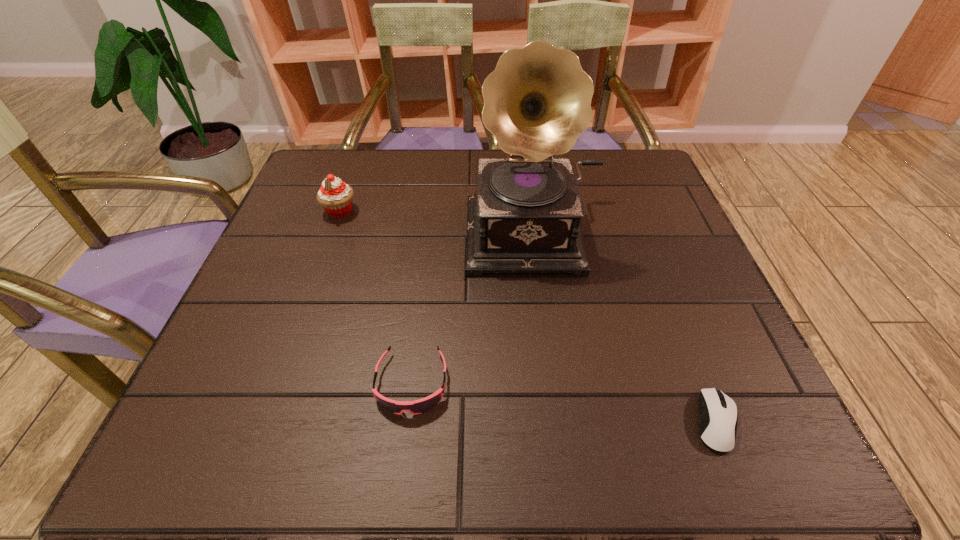
Find the location of a particular element. the tallest object is located at coordinates (524, 217).

Where is `the third object from left to right`? the third object from left to right is located at coordinates (524, 217).

Find the location of a particular element. The image size is (960, 540). the second tallest object is located at coordinates (335, 196).

Locate an element on the screen. The height and width of the screenshot is (540, 960). the leftmost object is located at coordinates (335, 196).

Locate an element on the screen. the second object from left to right is located at coordinates (420, 406).

I want to click on mouse, so click(x=717, y=426).

I want to click on the shortest object, so click(717, 426).

This screenshot has height=540, width=960. I want to click on vacant space situated 0.110m on the horn of the third object from left to right, so click(547, 317).

This screenshot has height=540, width=960. Identify the location of vacant space located on the front of the leftmost object. (305, 309).

I want to click on free point located 0.230m on the back of the rightmost object, so click(665, 292).